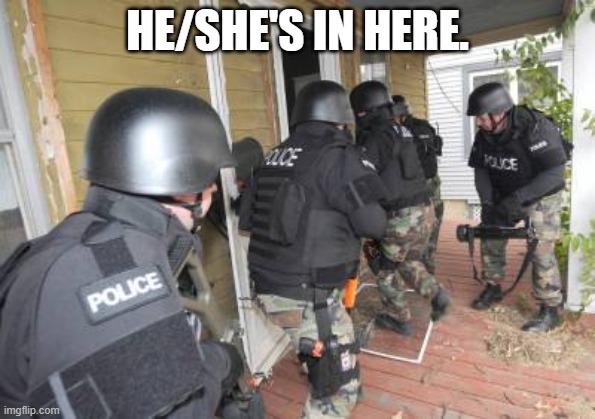
Image resolution: width=595 pixels, height=419 pixels. In order to click on doormat in this screenshot , I will do `click(361, 315)`.